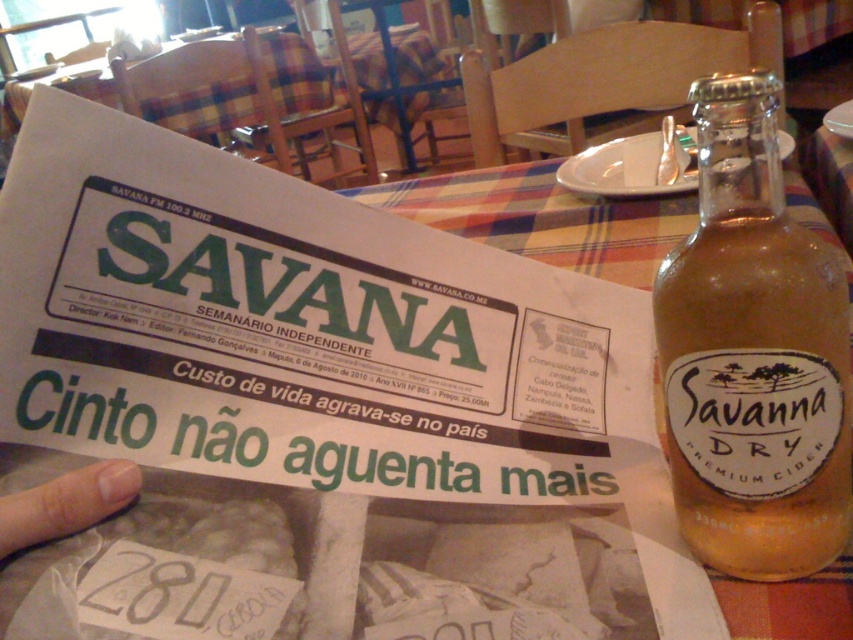
Question: Estimate the real-world distances between objects in this image. Which object is closer to the flesh-toned skin at lower left?

Choices:
 (A) plaid fabric table at upper center
 (B) translucent glass bottle at upper right

Answer: (B)

Question: Can you confirm if translucent glass bottle at upper right is positioned to the left of flesh-toned skin at lower left?

Choices:
 (A) no
 (B) yes

Answer: (A)

Question: Which of the following is the farthest from the observer?

Choices:
 (A) plaid fabric table at upper center
 (B) translucent glass bottle at upper right

Answer: (A)

Question: Does translucent glass bottle at upper right have a smaller size compared to flesh-toned skin at lower left?

Choices:
 (A) no
 (B) yes

Answer: (A)

Question: Which point is closer to the camera taking this photo?

Choices:
 (A) (247, 120)
 (B) (102, 509)

Answer: (B)

Question: Is translucent glass bottle at upper right further to the viewer compared to plaid fabric table at upper center?

Choices:
 (A) yes
 (B) no

Answer: (B)